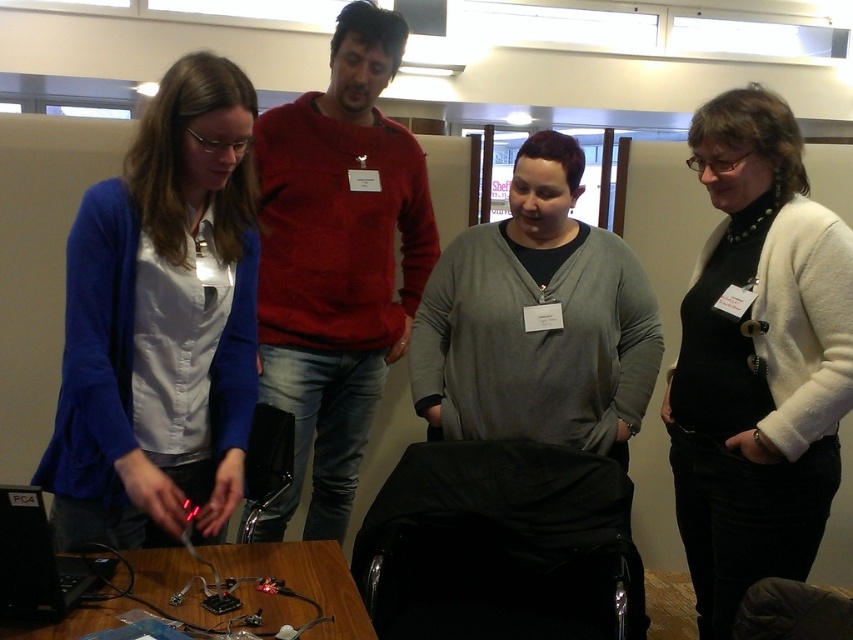
Does gray matte sweater at center appear over wooden table at lower left?

Yes, gray matte sweater at center is above wooden table at lower left.

Who is more distant from viewer, (474,244) or (344,611)?

The point (474,244) is more distant.

The height and width of the screenshot is (640, 853). Find the location of `gray matte sweater at center`. gray matte sweater at center is located at coordinates (537, 321).

Can you confirm if white wool sweater at upper right is taller than gray matte sweater at center?

Indeed, white wool sweater at upper right has a greater height compared to gray matte sweater at center.

Is white wool sweater at upper right closer to the viewer compared to gray matte sweater at center?

Yes.

What do you see at coordinates (757, 358) in the screenshot? The image size is (853, 640). I see `white wool sweater at upper right` at bounding box center [757, 358].

The image size is (853, 640). Find the location of `white wool sweater at upper right`. white wool sweater at upper right is located at coordinates (757, 358).

Locate an element on the screen. The height and width of the screenshot is (640, 853). white wool sweater at upper right is located at coordinates (757, 358).